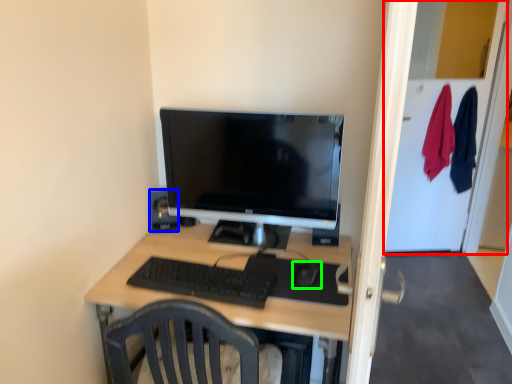
Question: Considering the real-world distances, which object is closest to glass door (highlighted by a red box)? speaker (highlighted by a blue box) or mouse (highlighted by a green box).

Choices:
 (A) speaker
 (B) mouse

Answer: (B)